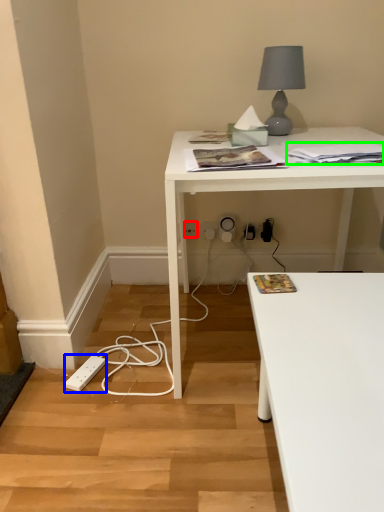
Question: Considering the real-world distances, which object is farthest from electric outlet (highlighted by a red box)? extension cord (highlighted by a blue box) or magazine (highlighted by a green box)?

Choices:
 (A) extension cord
 (B) magazine

Answer: (B)